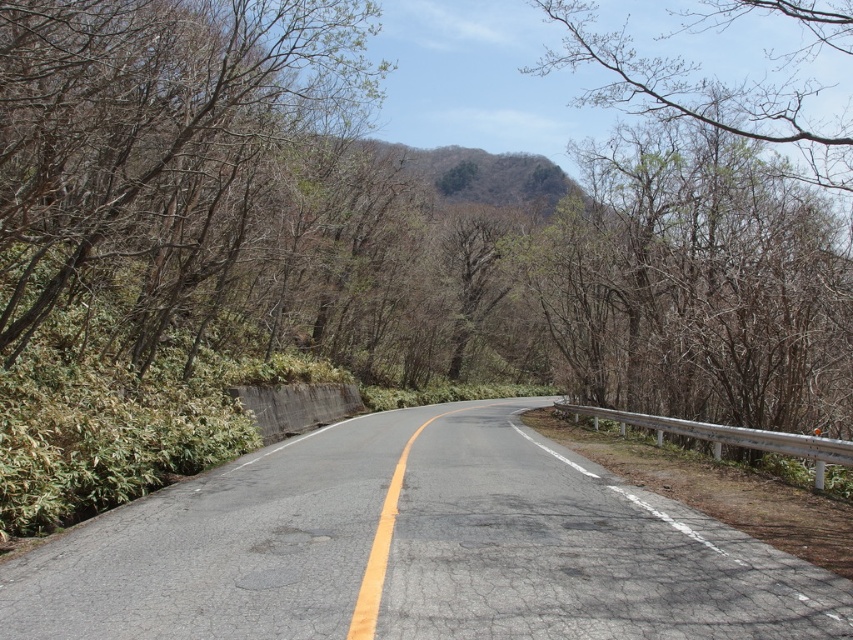
Question: Which of the following is the farthest from the observer?

Choices:
 (A) (358, 490)
 (B) (15, 218)

Answer: (B)

Question: Among these points, which one is farthest from the camera?

Choices:
 (A) (32, 61)
 (B) (503, 564)

Answer: (A)

Question: Can you confirm if black asphalt road at center is thinner than brown/dry wood at left?

Choices:
 (A) no
 (B) yes

Answer: (B)

Question: Does black asphalt road at center appear over brown/dry wood at left?

Choices:
 (A) yes
 (B) no

Answer: (B)

Question: Can you confirm if black asphalt road at center is wider than brown/dry wood at left?

Choices:
 (A) no
 (B) yes

Answer: (A)